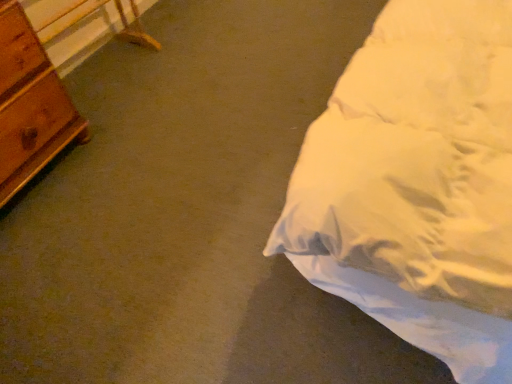
Question: Based on their sizes in the image, would you say wooden chest of drawers at left is bigger or smaller than wooden table at left?

Choices:
 (A) small
 (B) big

Answer: (B)

Question: Looking at their shapes, would you say wooden chest of drawers at left is wider or thinner than wooden table at left?

Choices:
 (A) thin
 (B) wide

Answer: (B)

Question: Relative to wooden table at left, is wooden chest of drawers at left in front or behind?

Choices:
 (A) front
 (B) behind

Answer: (A)

Question: Is wooden table at left bigger or smaller than wooden chest of drawers at left?

Choices:
 (A) small
 (B) big

Answer: (A)

Question: Is wooden table at left in front of or behind wooden chest of drawers at left in the image?

Choices:
 (A) front
 (B) behind

Answer: (B)

Question: Looking at their shapes, would you say wooden table at left is wider or thinner than wooden chest of drawers at left?

Choices:
 (A) thin
 (B) wide

Answer: (A)

Question: Does point (90, 49) appear closer or farther from the camera than point (83, 137)?

Choices:
 (A) closer
 (B) farther

Answer: (B)